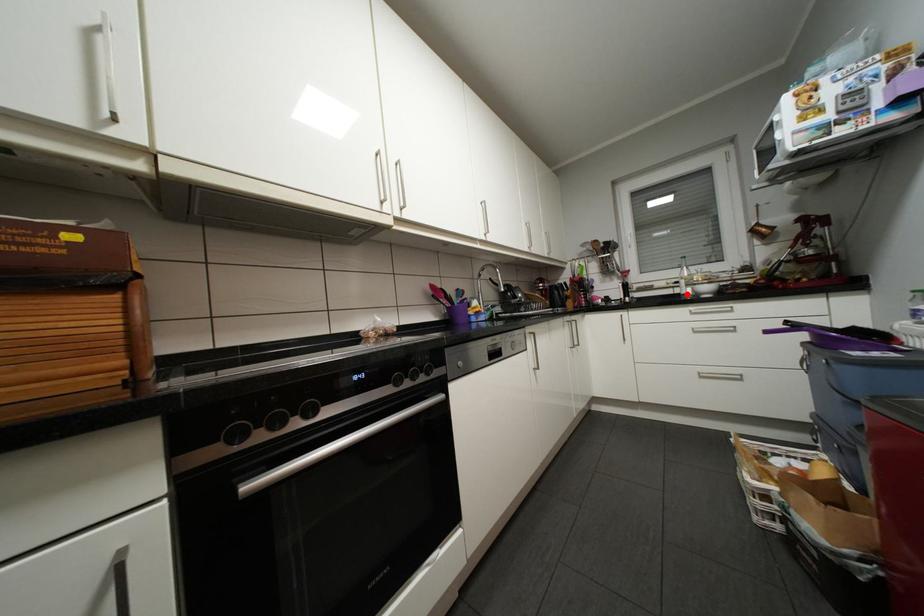
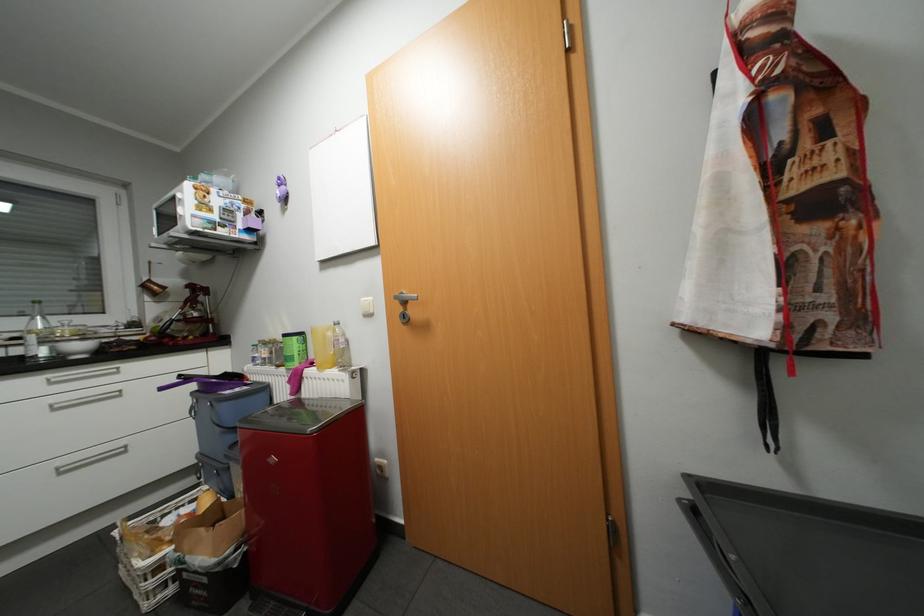
Find the pixel in the second image that matches the highlighted location in the first image.

(30, 357)